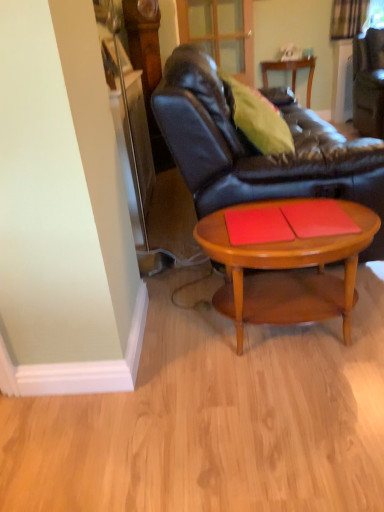
This screenshot has width=384, height=512. I want to click on free space above light brown wood coffee table at center (from a real-world perspective), so click(x=290, y=221).